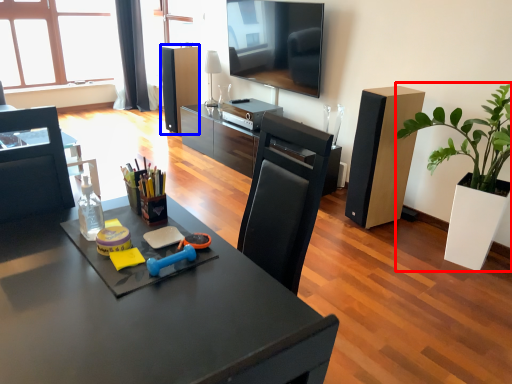
Question: Which of the following is the farthest to the observer, houseplant (highlighted by a red box) or speaker (highlighted by a blue box)?

Choices:
 (A) houseplant
 (B) speaker

Answer: (B)